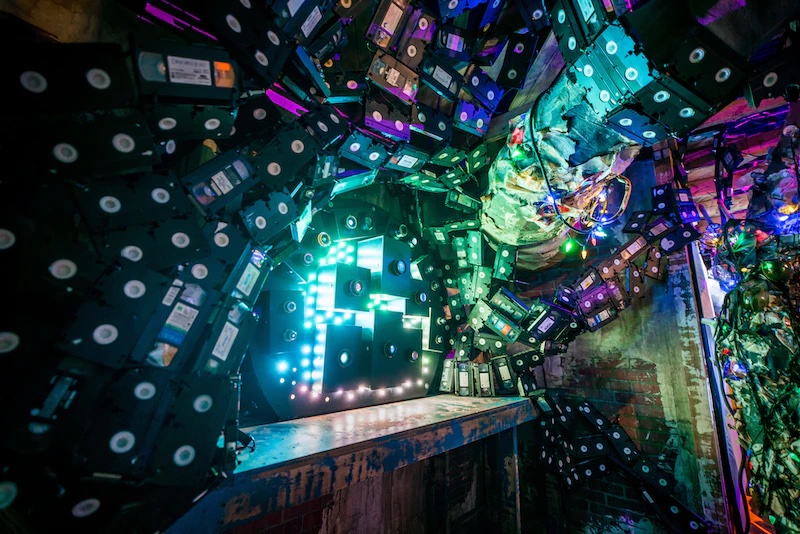
Image resolution: width=800 pixels, height=534 pixels. Identify the location of christmas lights. (568, 244).